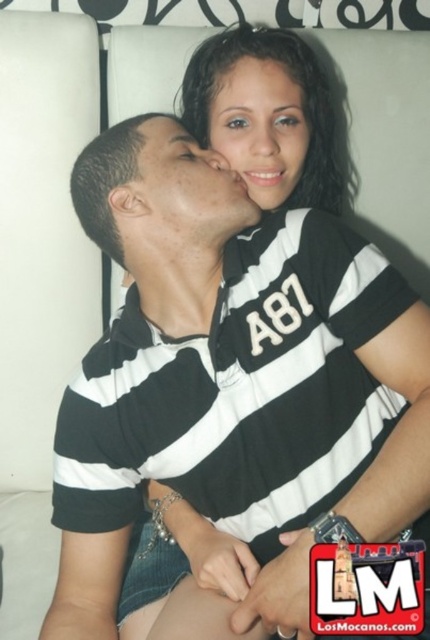
What are the coordinates of the matte black face at upper center?

The matte black face at upper center is located at point (260, 125).

Based on the scene, which object is bigger between the black striped polo shirt at center and the matte black face at upper right?

The black striped polo shirt at center is larger than the matte black face at upper right.